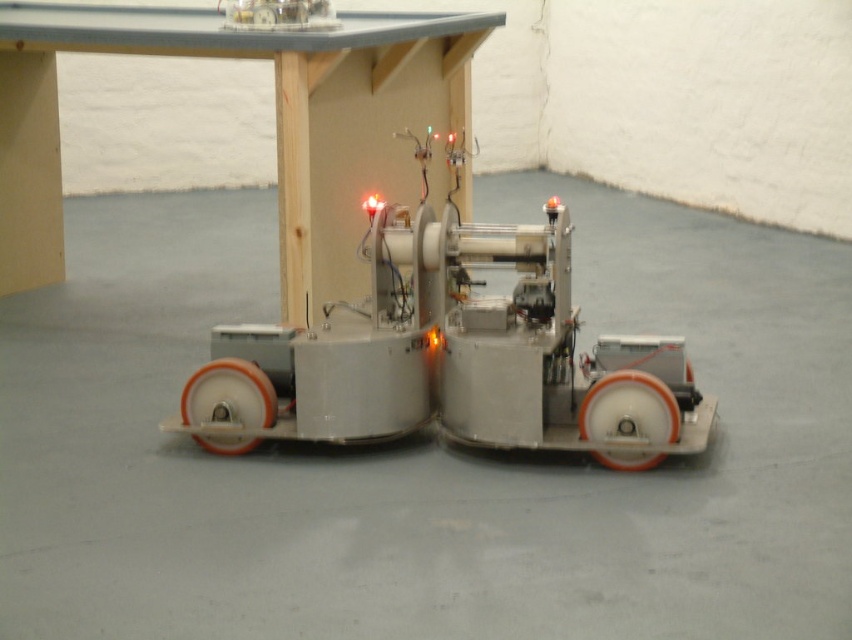
Question: Estimate the real-world distances between objects in this image. Which object is closer to the orange rubber wheel at lower right?

Choices:
 (A) orange rubber wheel at lower left
 (B) metallic robot at center

Answer: (B)

Question: Which point is closer to the camera taking this photo?

Choices:
 (A) (240, 442)
 (B) (758, 291)
 (C) (619, 392)

Answer: (C)

Question: Where is orange rubber wheel at lower right located in relation to orange rubber wheel at lower left in the image?

Choices:
 (A) above
 (B) below

Answer: (B)

Question: Is metallic robot at center wider than orange rubber wheel at lower right?

Choices:
 (A) yes
 (B) no

Answer: (B)

Question: Is metallic robot at center wider than orange rubber wheel at lower right?

Choices:
 (A) no
 (B) yes

Answer: (A)

Question: Based on their relative distances, which object is nearer to the orange rubber wheel at lower left?

Choices:
 (A) orange rubber wheel at lower right
 (B) metallic robot at center

Answer: (A)